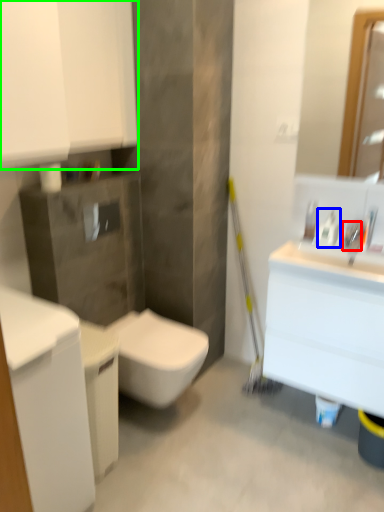
Question: Based on their relative distances, which object is farther from faucet (highlighted by a red box)? Choose from cleaning product (highlighted by a blue box) and bathroom cabinet (highlighted by a green box).

Choices:
 (A) cleaning product
 (B) bathroom cabinet

Answer: (B)